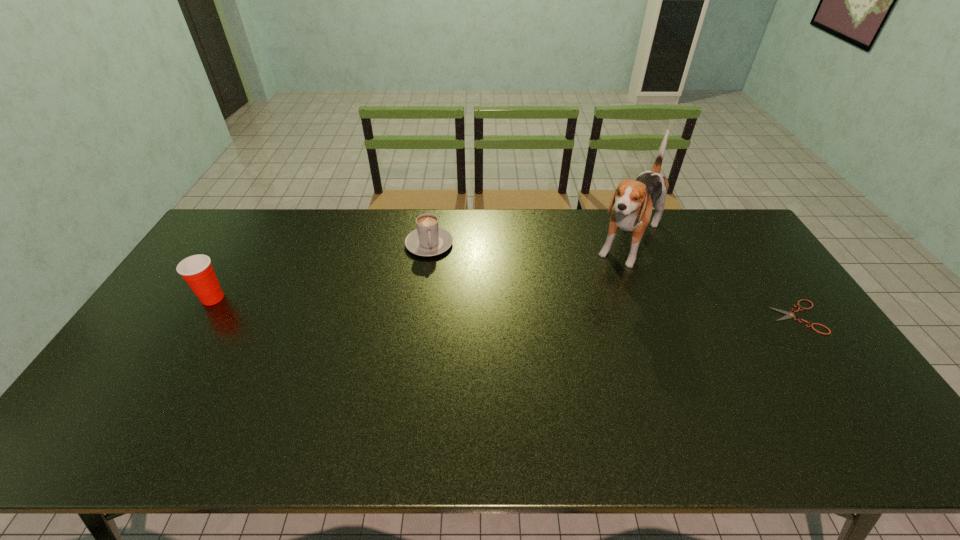
The height and width of the screenshot is (540, 960). What are the coordinates of `vacant space positioned 0.060m to the right of the cappuccino` in the screenshot? It's located at (435, 271).

This screenshot has height=540, width=960. Find the location of `vacant area situated 0.100m to the right of the cappuccino`. vacant area situated 0.100m to the right of the cappuccino is located at coordinates (436, 279).

Identify the location of vacant space located to the right of the cappuccino. (446, 332).

Where is `free space located 0.310m at the face of the puppy`? This screenshot has width=960, height=540. free space located 0.310m at the face of the puppy is located at coordinates (578, 336).

This screenshot has height=540, width=960. What are the coordinates of `vacant space located 0.100m at the face of the puppy` in the screenshot? It's located at (606, 292).

Locate an element on the screen. The image size is (960, 540). vacant space located at the face of the puppy is located at coordinates (582, 329).

Identify the location of cappuccino at the far edge. (429, 239).

You are a GUI agent. You are given a task and a screenshot of the screen. Output one action in this format:
    pyautogui.click(x=<x>, y=<y>)
    Task: Click on the puppy that is at the far edge
    The width and height of the screenshot is (960, 540).
    Given the screenshot: What is the action you would take?
    pyautogui.click(x=634, y=199)

Identify the location of object positioned at the left edge. (197, 270).

You are a GUI agent. You are given a task and a screenshot of the screen. Output one action in this format:
    pyautogui.click(x=<x>, y=<y>)
    Task: Click on the object positioned at the right edge
    The width and height of the screenshot is (960, 540).
    Given the screenshot: What is the action you would take?
    pyautogui.click(x=790, y=314)